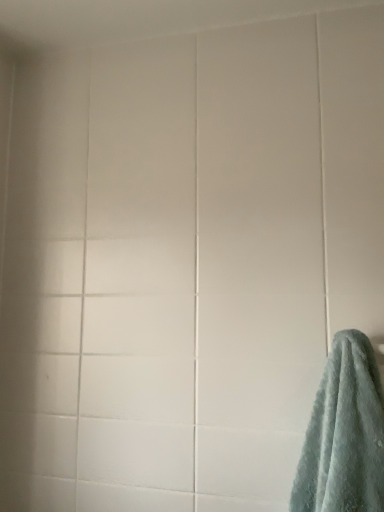
Question: Should I look upward or downward to see teal soft towel at lower right?

Choices:
 (A) up
 (B) down

Answer: (B)